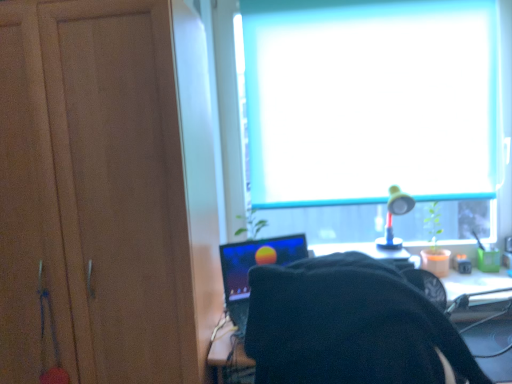
You are a GUI agent. You are given a task and a screenshot of the screen. Output one action in this format:
    pyautogui.click(x=<x>, y=<y>)
    Task: Click on the matte wood cabinet at left
    
    Given the screenshot: What is the action you would take?
    pyautogui.click(x=94, y=191)

What do you see at coordinates (94, 191) in the screenshot? I see `matte wood cabinet at left` at bounding box center [94, 191].

Find the location of `matte wood cabinet at left`. matte wood cabinet at left is located at coordinates (94, 191).